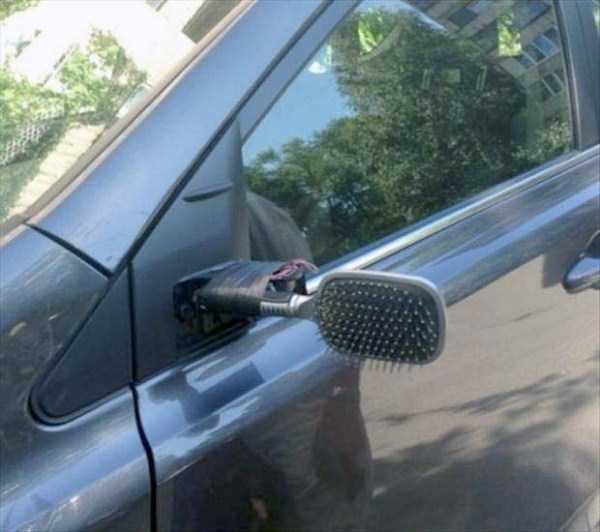
Identify the location of wires. This screenshot has height=532, width=600. (298, 272).